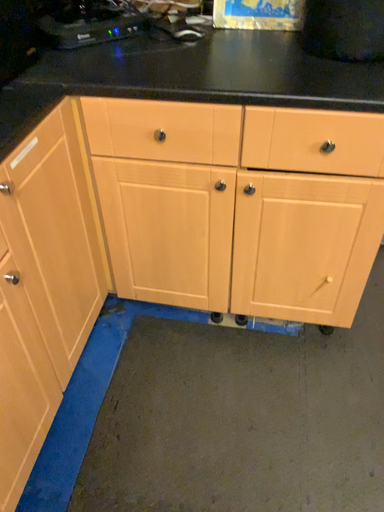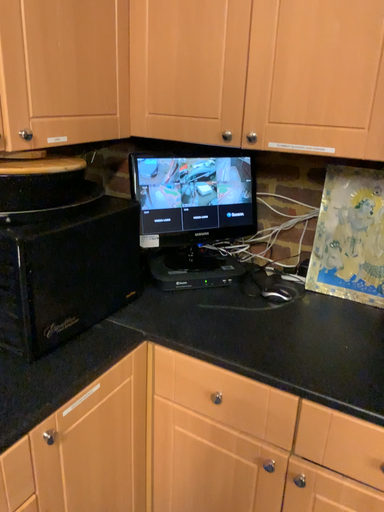
Question: Which way did the camera rotate in the video?

Choices:
 (A) rotated downward
 (B) rotated upward

Answer: (B)